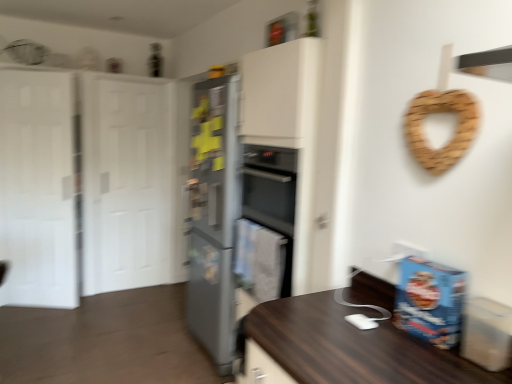
Question: From their relative heights in the image, would you say white glossy door at left, the first glass door in the back-to-front sequence, is taller or shorter than satin silver refrigerator at center?

Choices:
 (A) short
 (B) tall

Answer: (B)

Question: From a real-world perspective, relative to satin silver refrigerator at center, is white glossy door at left, which ranks as the 2th glass door in front-to-back order, vertically above or below?

Choices:
 (A) above
 (B) below

Answer: (A)

Question: Which of these objects is positioned closest to the white glossy door at left, arranged as the 2th glass door when viewed from the right?

Choices:
 (A) white glossy door at left, the first glass door in the back-to-front sequence
 (B) satin silver refrigerator at center
 (C) white matte door at left

Answer: (C)

Question: Which is nearer to the white glossy door at left, which is the first glass door in right-to-left order?

Choices:
 (A) white glossy door at left, the 1th glass door in the left-to-right sequence
 (B) white matte door at left
 (C) satin silver refrigerator at center

Answer: (B)